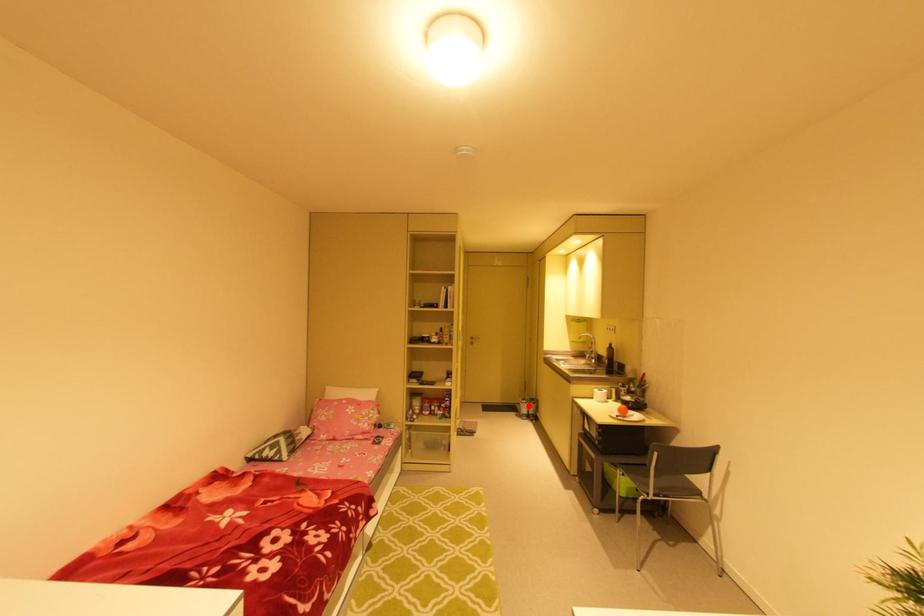
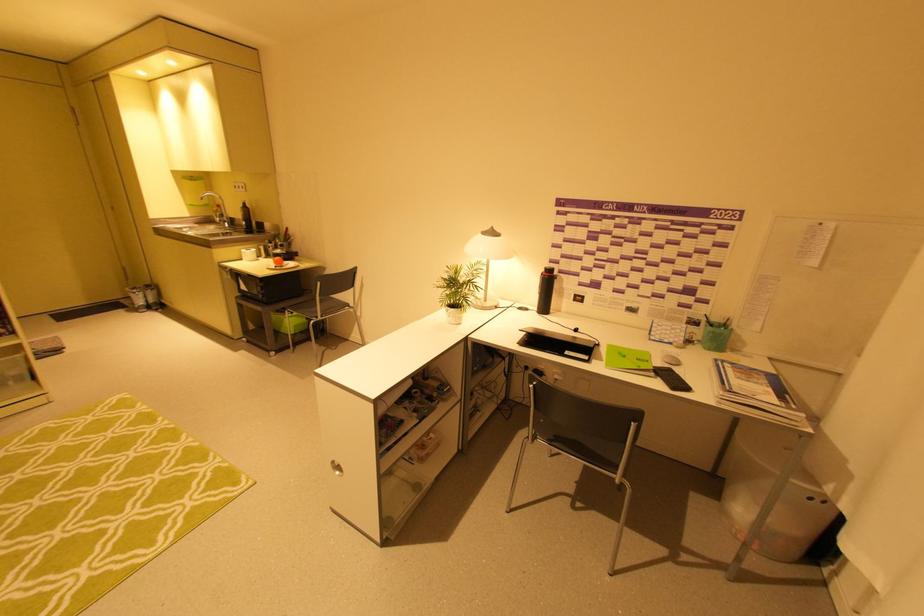
Question: I am providing you with two images of the same scene from different viewpoints. Given a red point in image1, look at the same physical point in image2. Is it:

Choices:
 (A) Closer to the viewpoint
 (B) Farther from the viewpoint

Answer: (A)